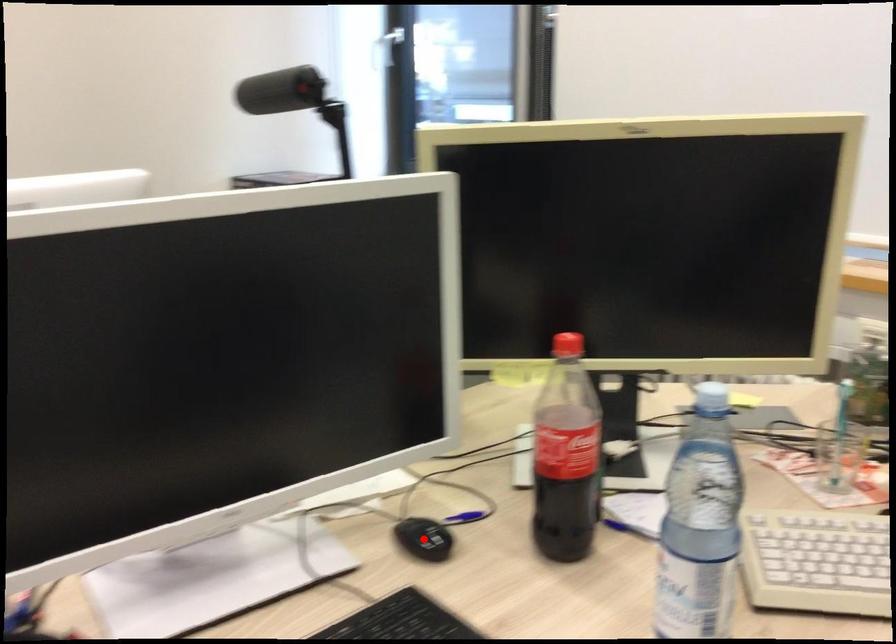
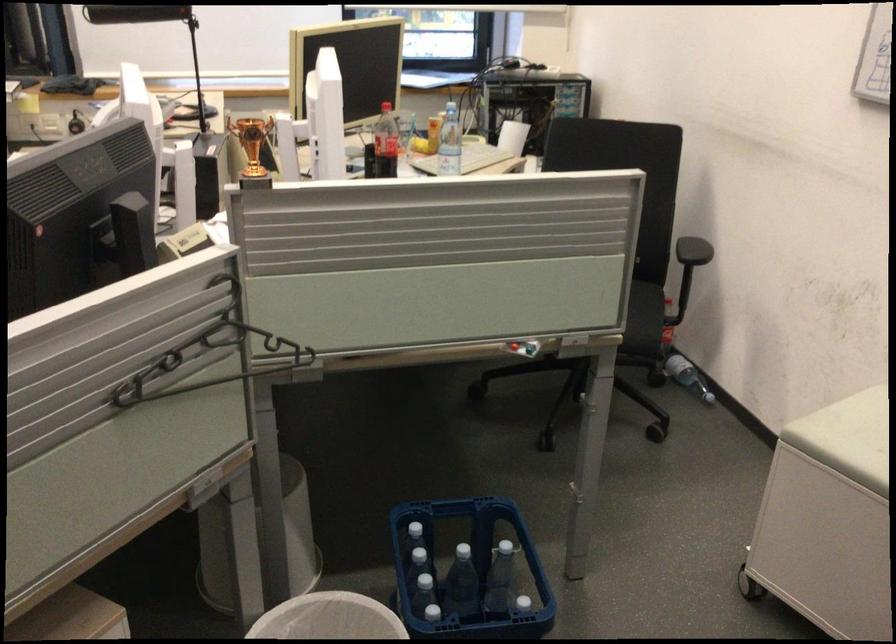
Question: I am providing you with two images of the same scene from different viewpoints. A red point is marked on the first image. At the location where the point appears in image 1, is it still visible in image 2?

Choices:
 (A) Yes
 (B) No

Answer: (B)